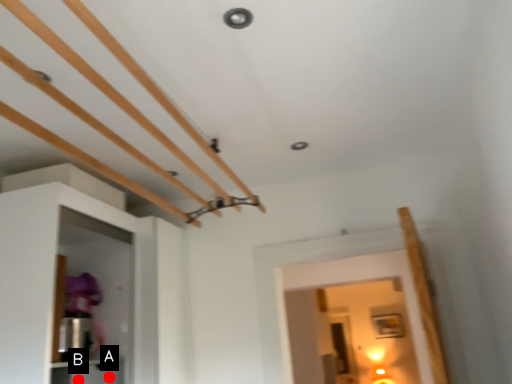
Question: Two points are circled on the image, labeled by A and B beside each circle. Which point is farther from the camera taking this photo?

Choices:
 (A) A is further
 (B) B is further

Answer: (A)